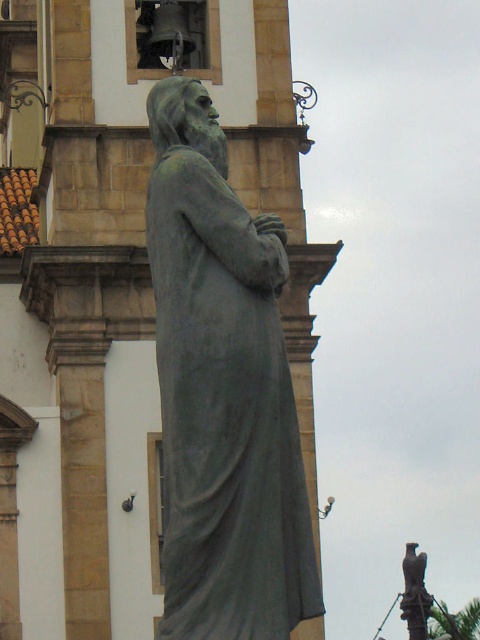
Consider the image. Can you confirm if green patina statue at center is shorter than bronze statue at lower right?

Incorrect, green patina statue at center's height does not fall short of bronze statue at lower right's.

Does green patina statue at center lie in front of bronze statue at lower right?

Yes.

Which is in front, point (256, 358) or point (422, 582)?

Point (256, 358) is in front.

Locate an element on the screen. The width and height of the screenshot is (480, 640). green patina statue at center is located at coordinates (223, 392).